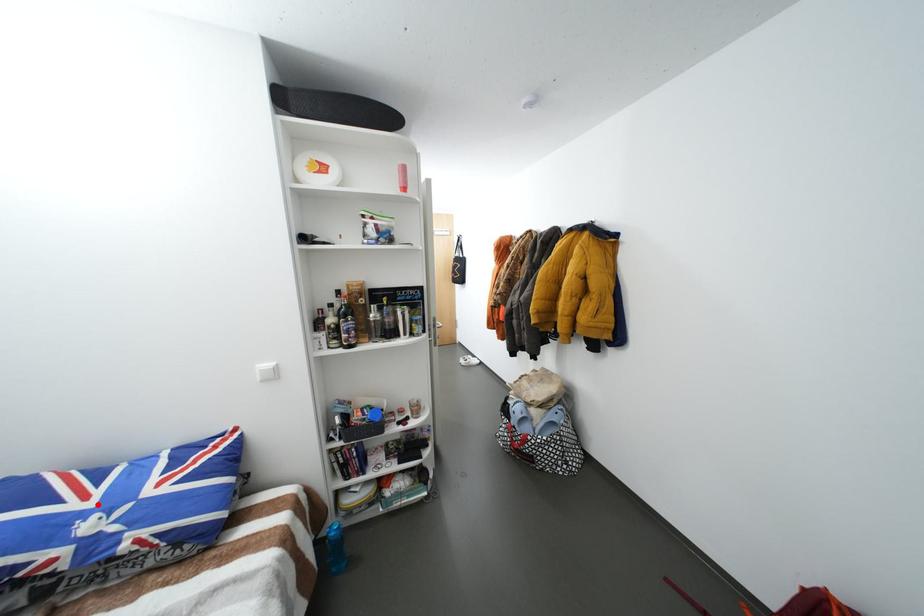
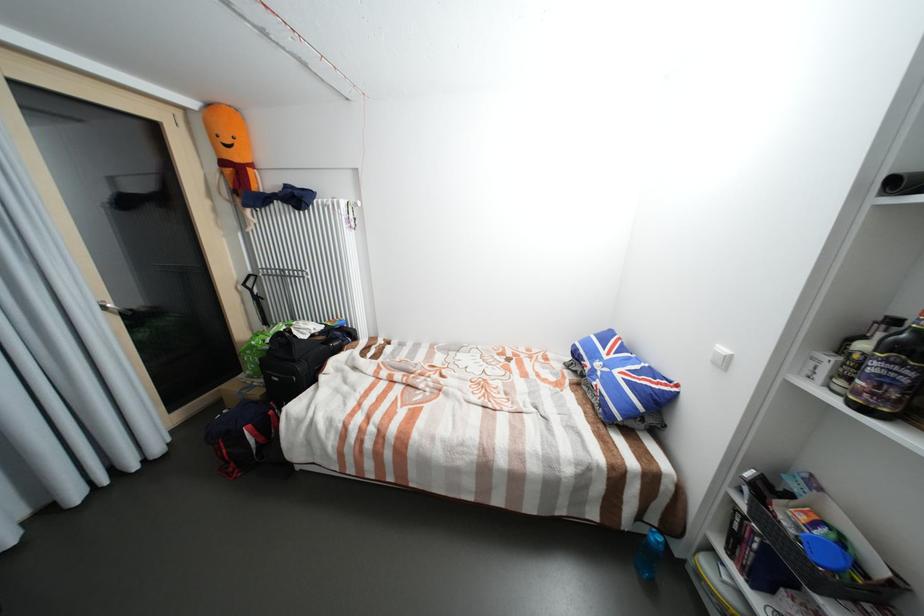
Where in the second image is the point corresponding to the highlighted location from the first image?

(613, 358)